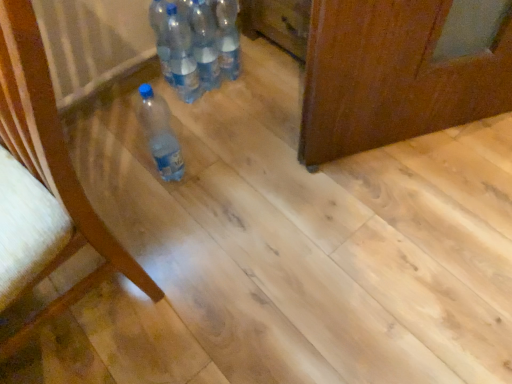
The image size is (512, 384). I want to click on vacant space that's between matte wood chair at left and translucent plastic bottles at center, the third bottle positioned from the bottom, so click(162, 181).